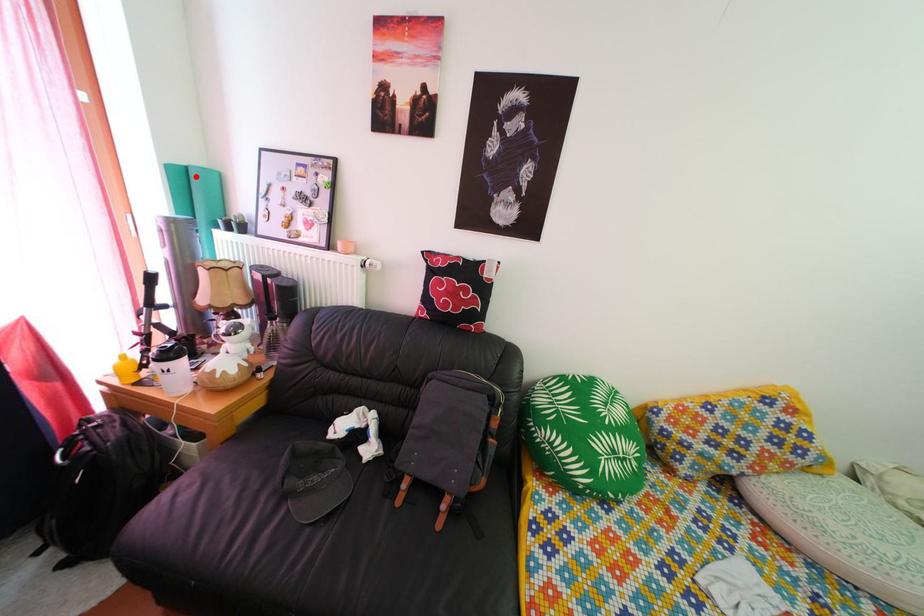
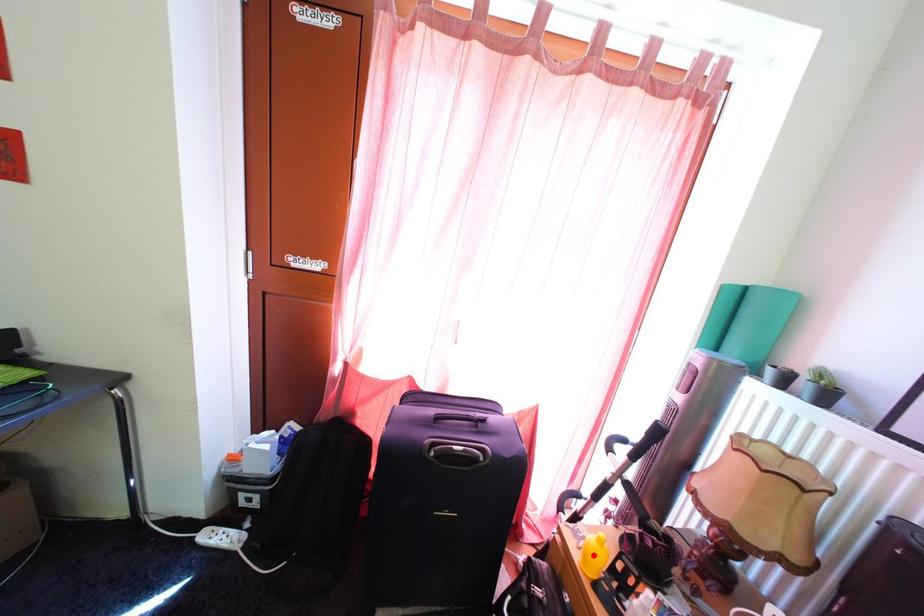
I am providing you with two images of the same scene from different viewpoints. A red point is marked on the first image and another point is marked on the second image. Is the red point in image1 aligned with the point shown in image2?

No